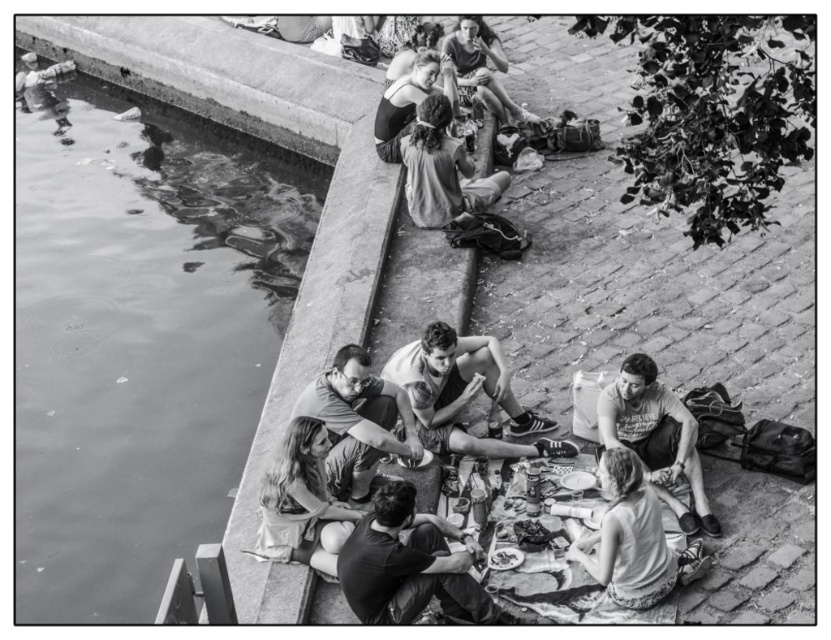
Question: Can you confirm if smooth white tank top at center is positioned to the right of rough fabric shirt at center?

Choices:
 (A) yes
 (B) no

Answer: (A)

Question: Does rough fabric shirt at center appear over metallic silver camera at upper left?

Choices:
 (A) yes
 (B) no

Answer: (B)

Question: Can you confirm if smooth fabric shirt at lower left is positioned below rough fabric shirt at center?

Choices:
 (A) yes
 (B) no

Answer: (A)

Question: Which point is farther from the camera taking this photo?

Choices:
 (A) (311, 240)
 (B) (307, 544)

Answer: (A)

Question: Which point is closer to the camera?

Choices:
 (A) rough fabric shirt at center
 (B) metallic silver camera at upper left
 (C) smooth gray shirt at center
 (D) matte white shirt at lower right

Answer: (C)

Question: Estimate the real-world distances between objects in this image. Which object is farther from the dark gray fabric at lower center?

Choices:
 (A) smooth concrete water at left
 (B) rough fabric shirt at center
 (C) smooth fabric shirt at lower left

Answer: (B)